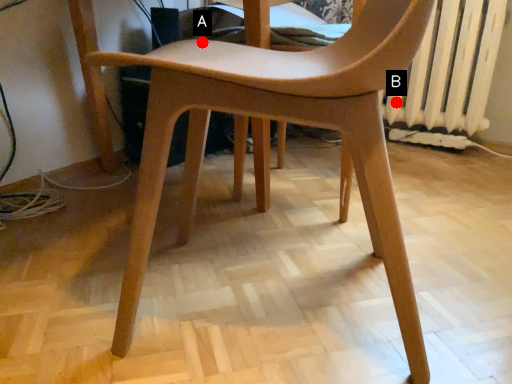
Question: Two points are circled on the image, labeled by A and B beside each circle. Which point is further to the camera?

Choices:
 (A) A is further
 (B) B is further

Answer: (B)